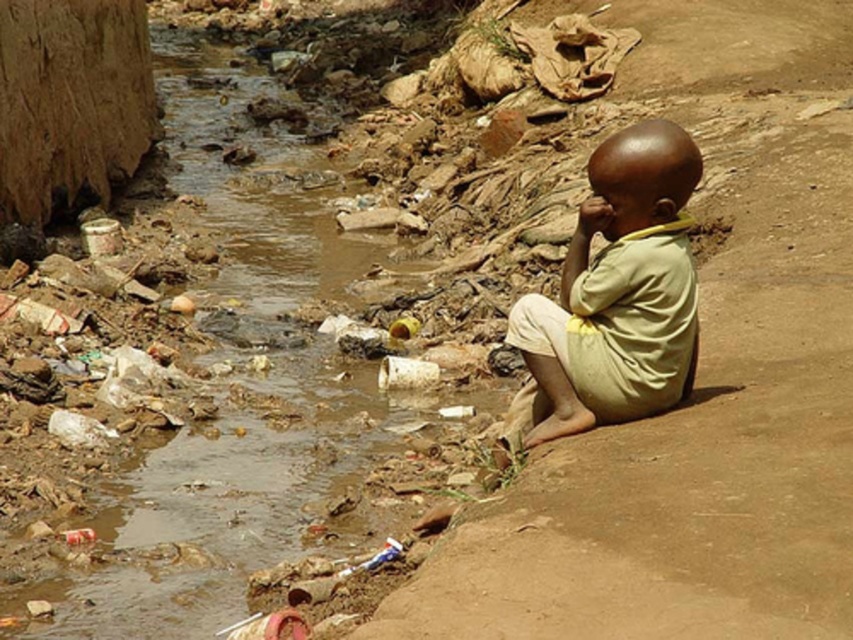
Who is positioned more to the left, brown dirt stream at lower left or light yellow fabric at right?

brown dirt stream at lower left is more to the left.

Which is behind, point (244, 216) or point (622, 196)?

Positioned behind is point (244, 216).

You are a GUI agent. You are given a task and a screenshot of the screen. Output one action in this format:
    pyautogui.click(x=<x>, y=<y>)
    Task: Click on the brown dirt stream at lower left
    The image size is (853, 640).
    Given the screenshot: What is the action you would take?
    pyautogui.click(x=218, y=508)